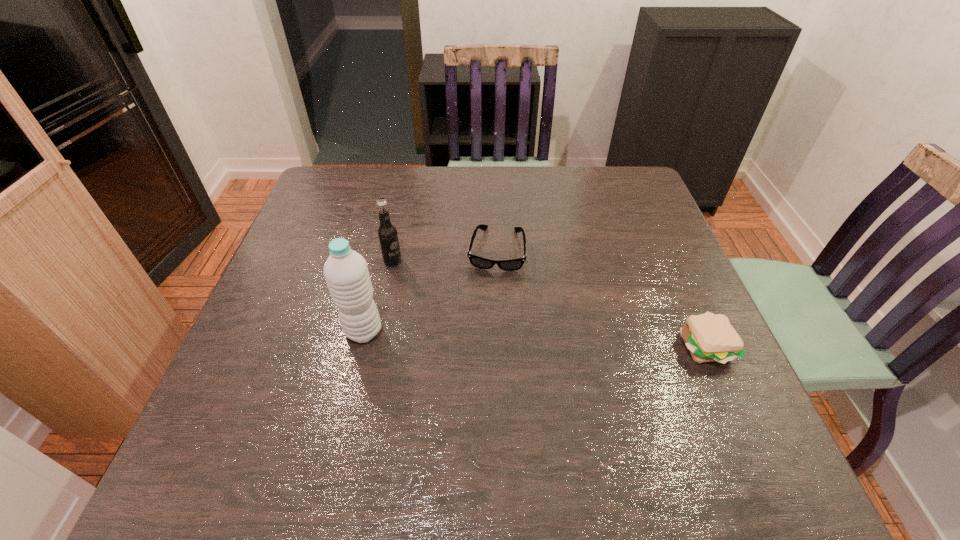
I want to click on vacant spot on the desktop that is between the water bottle and the rightmost object and is positioned on the label of the root beer, so click(x=520, y=338).

At what (x,y) coordinates should I click in order to perform the action: click on free space on the desktop that is between the water bottle and the third tallest object and is positioned on the front-facing side of the shortest object. Please return your answer as a coordinate pair (x, y). The width and height of the screenshot is (960, 540). Looking at the image, I should click on pyautogui.click(x=485, y=336).